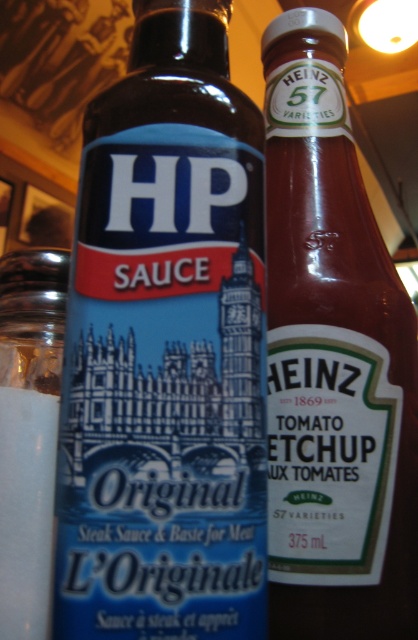
Is matte plastic hp sauce at left further to the viewer compared to matte glass bottle of ketchup at center?

No, it is not.

The image size is (418, 640). What do you see at coordinates (165, 349) in the screenshot?
I see `matte plastic hp sauce at left` at bounding box center [165, 349].

You are a GUI agent. You are given a task and a screenshot of the screen. Output one action in this format:
    pyautogui.click(x=<x>, y=<y>)
    Task: Click on the matte plastic hp sauce at left
    
    Given the screenshot: What is the action you would take?
    pyautogui.click(x=165, y=349)

Is point (234, 516) farther from viewer compared to point (4, 589)?

No, (234, 516) is closer to viewer.

Can you confirm if matte plastic hp sauce at left is wider than clear glass salt shaker at left?

Yes.

Does point (60, 500) come farther from viewer compared to point (12, 529)?

That is False.

The height and width of the screenshot is (640, 418). What are the coordinates of `matte plastic hp sauce at left` in the screenshot? It's located at (165, 349).

Between matte glass bottle of ketchup at center and clear glass salt shaker at left, which one is positioned lower?

Positioned lower is clear glass salt shaker at left.

Between matte glass bottle of ketchup at center and clear glass salt shaker at left, which one is positioned higher?

matte glass bottle of ketchup at center is above.

Is point (413, 461) farther from viewer compared to point (7, 396)?

Yes.

Identify the location of matte glass bottle of ketchup at center. (333, 362).